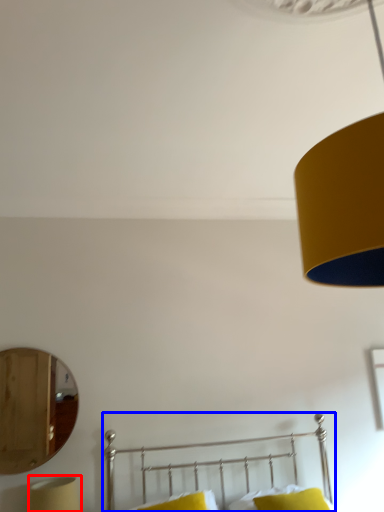
Question: Which point is further to the camera, bedside lamp (highlighted by a red box) or bed (highlighted by a blue box)?

Choices:
 (A) bedside lamp
 (B) bed

Answer: (A)